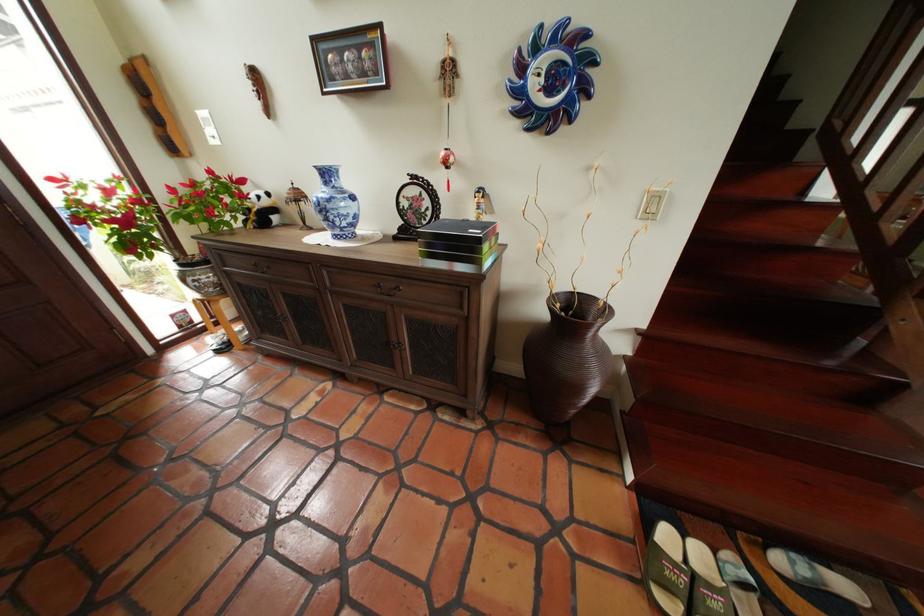
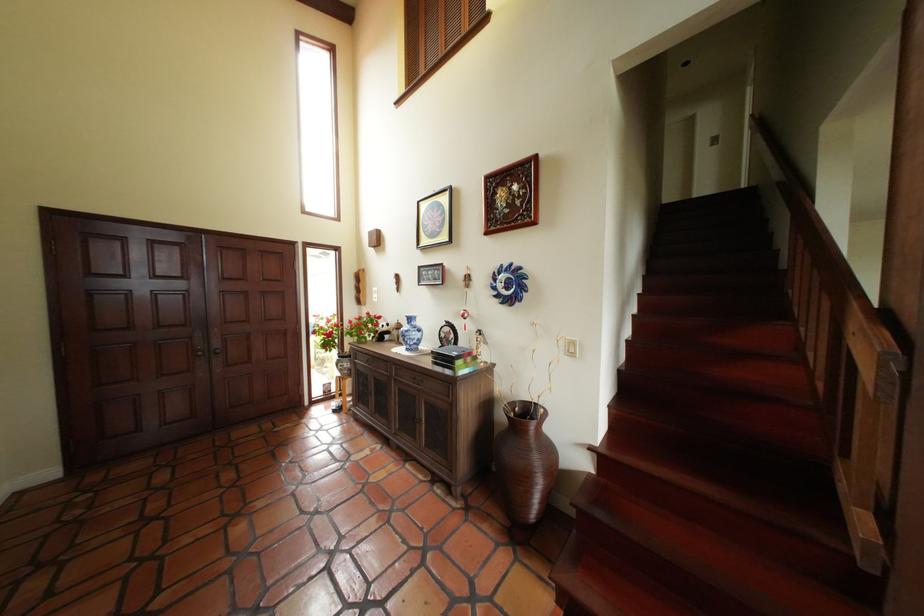
Where in the second image is the point corresponding to point (584, 314) from the first image?

(541, 418)